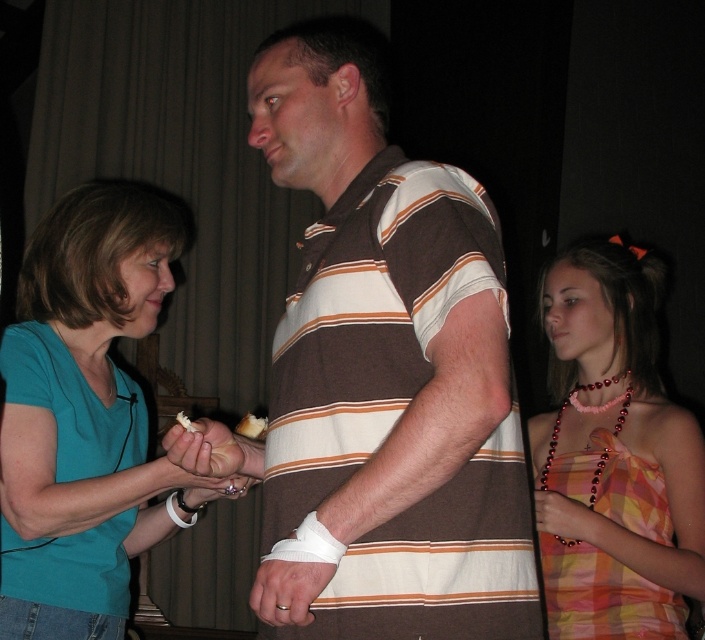
You are standing in the room and want to hand a gift to the teal fabric shirt at left without disturbing the pink beaded necklace at upper right. Which object should you avoid placing the gift near?

You should avoid placing the gift near the pink beaded necklace at upper right because the teal fabric shirt at left is above it, so placing the gift near the necklace might interfere with the shirt.

You are standing at the center of the room. Which direction should you walk to reach the teal fabric shirt at left?

The teal fabric shirt at left is located at point [85,417], so you should walk to the left to reach it.

In the scene shown: You are at a party and see the brown striped shirt at center and the white creamy cake at center. Which one is higher?

The brown striped shirt at center is located above the white creamy cake at center, so it is higher.